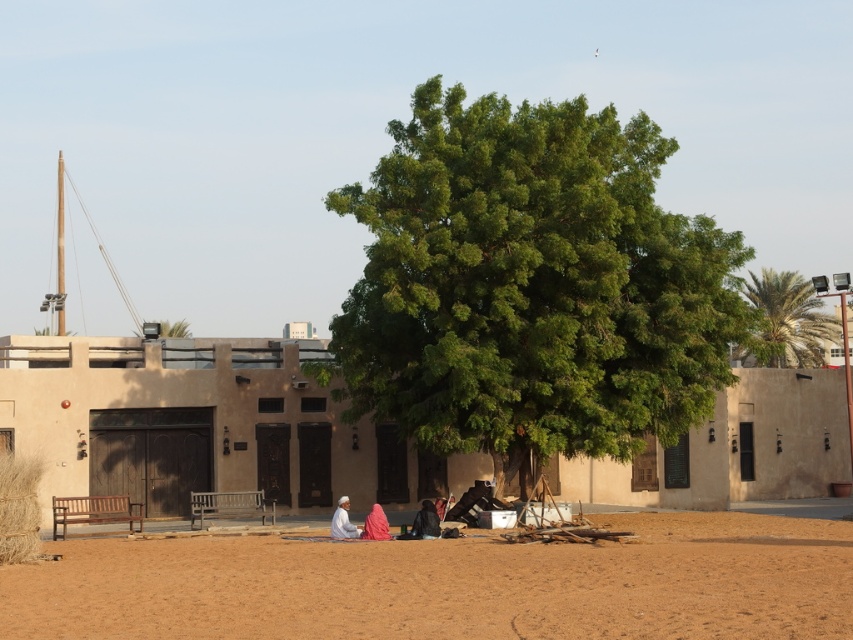
Question: Is green leafy tree at upper right positioned in front of dark brown leather jacket at lower center?

Choices:
 (A) no
 (B) yes

Answer: (A)

Question: Can you confirm if green leafy tree at center is positioned to the left of green leafy tree at upper right?

Choices:
 (A) no
 (B) yes

Answer: (B)

Question: Can you confirm if wooden bench at center is positioned above dark brown leather jacket at lower center?

Choices:
 (A) no
 (B) yes

Answer: (A)

Question: Among these points, which one is farthest from the camera?

Choices:
 (A) (231, 506)
 (B) (338, 536)
 (C) (369, 538)
 (D) (125, 531)

Answer: (A)

Question: Which point appears farthest from the camera in this image?

Choices:
 (A) (151, 548)
 (B) (819, 353)
 (C) (231, 508)
 (D) (137, 508)

Answer: (B)

Question: Which point is closer to the camera?

Choices:
 (A) wooden bench at lower left
 (B) white fabric at center
 (C) wooden bench at center
 (D) dark brown leather jacket at lower center

Answer: (D)